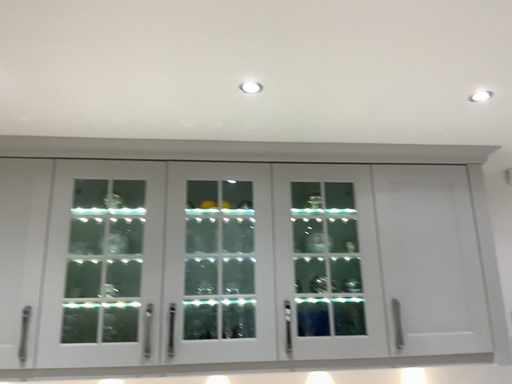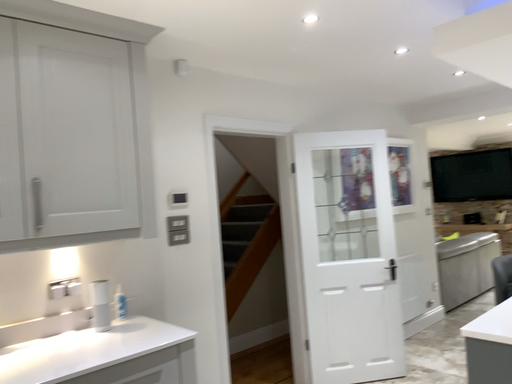
Question: How did the camera likely rotate when shooting the video?

Choices:
 (A) rotated left
 (B) rotated right

Answer: (B)